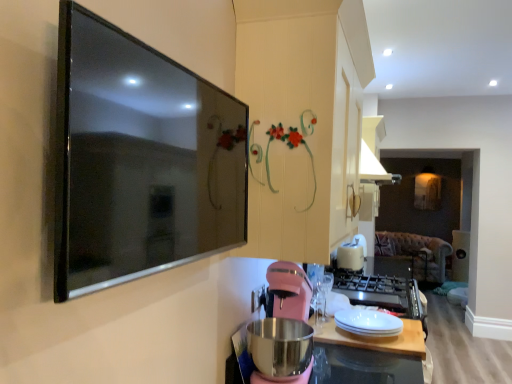
Question: From the image's perspective, relative to white glossy plate at center, is pink matte blender at lower center above or below?

Choices:
 (A) below
 (B) above

Answer: (B)

Question: From a real-world perspective, is pink matte blender at lower center physically located above or below white glossy plate at center?

Choices:
 (A) above
 (B) below

Answer: (A)

Question: Estimate the real-world distances between objects in this image. Which object is farther from the white matte wood at center?

Choices:
 (A) white plastic toaster at upper center
 (B) white glossy plate at center
 (C) yellow matte cabinet at upper center
 (D) metallic stainless steel at lower center
 (E) black glossy tv at upper left

Answer: (A)

Question: Which of these objects is positioned closest to the yellow matte cabinet at upper center?

Choices:
 (A) white glossy plate at center
 (B) white matte wood at center
 (C) white plastic toaster at upper center
 (D) metallic stainless steel at lower center
 (E) pink matte blender at lower center

Answer: (E)